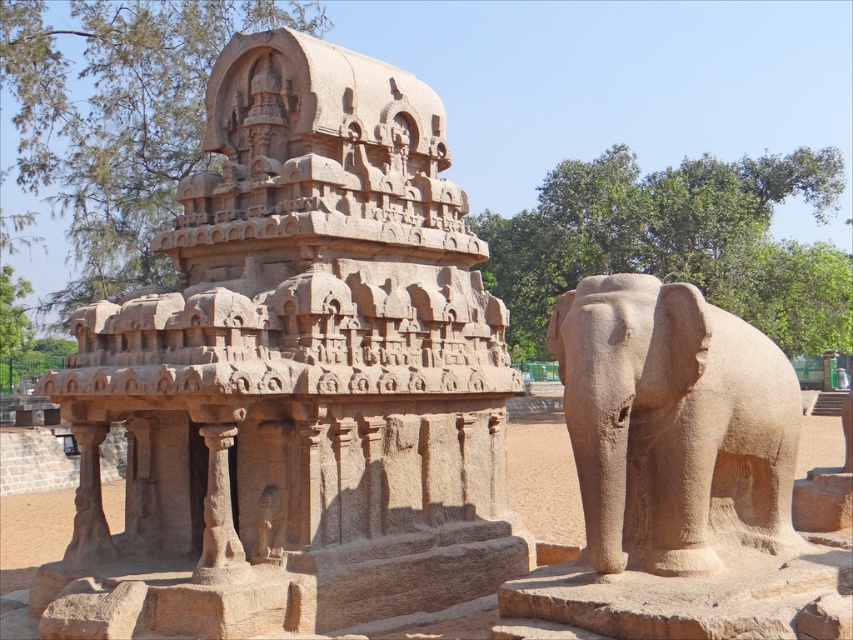
Question: Which object is closer to the camera taking this photo?

Choices:
 (A) sandy stone temple at center
 (B) sandy stone elephant at right

Answer: (B)

Question: Which point is closer to the camera?

Choices:
 (A) sandy stone temple at center
 (B) sandy stone elephant at right

Answer: (B)

Question: Does sandy stone temple at center appear over sandy stone elephant at right?

Choices:
 (A) yes
 (B) no

Answer: (A)

Question: Observing the image, what is the correct spatial positioning of sandy stone temple at center in reference to sandy stone elephant at right?

Choices:
 (A) left
 (B) right

Answer: (A)

Question: Among these objects, which one is nearest to the camera?

Choices:
 (A) sandy stone elephant at right
 (B) sandy stone temple at center

Answer: (A)

Question: Does sandy stone temple at center have a lesser width compared to sandy stone elephant at right?

Choices:
 (A) yes
 (B) no

Answer: (B)